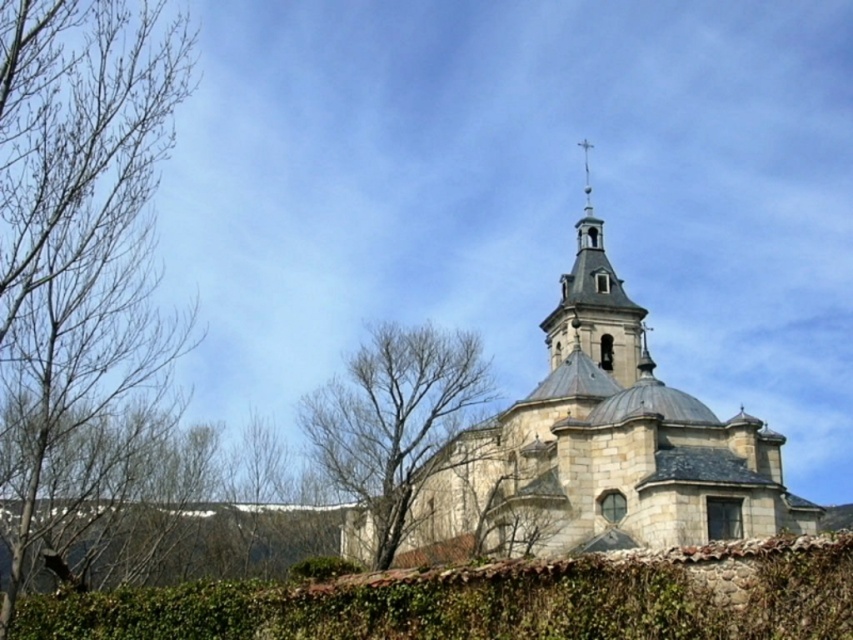
Based on the photo, measure the distance from bare wood tree at center to stone bell tower at upper center.

bare wood tree at center and stone bell tower at upper center are 23.21 meters apart from each other.

Is point (438, 355) farther from camera compared to point (550, 330)?

No, (438, 355) is in front of (550, 330).

Find the location of a particular element. The height and width of the screenshot is (640, 853). bare wood tree at center is located at coordinates (393, 420).

Is point (456, 614) closer to camera compared to point (412, 452)?

Yes, point (456, 614) is in front of point (412, 452).

Which of these two, green ivy hedge at lower center or bare wood tree at center, stands shorter?

green ivy hedge at lower center

The width and height of the screenshot is (853, 640). In order to click on green ivy hedge at lower center in this screenshot , I will do `click(494, 600)`.

Which is more to the right, stone church at center or green ivy hedge at lower center?

stone church at center

Is stone church at center positioned at the back of green ivy hedge at lower center?

Yes, stone church at center is behind green ivy hedge at lower center.

The width and height of the screenshot is (853, 640). What do you see at coordinates (601, 445) in the screenshot?
I see `stone church at center` at bounding box center [601, 445].

The width and height of the screenshot is (853, 640). I want to click on stone church at center, so click(x=601, y=445).